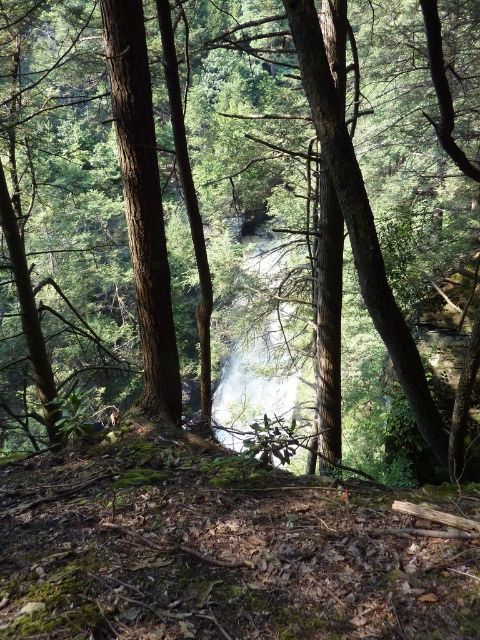
You are standing in the forest and want to take a photo of both the smooth brown tree trunk at center and the white misty waterfall at center. Which object should you focus on first to ensure both are in clear view?

You should focus on the smooth brown tree trunk at center first because it is closer to you than the white misty waterfall at center. By focusing on the closer object, you can ensure both are in focus as the waterfall is further away.

You are a hiker trying to cross the forest. You see the smooth brown tree trunk at center and the white misty waterfall at center. Which object is narrower?

The smooth brown tree trunk at center is narrower than the white misty waterfall at center.

You are standing in the forest scene described, and you want to reach a specific point marked at coordinates point (122, 92). If your walking speed is 3 feet per second, how many seconds will it take you to reach that point?

The distance of point (122, 92) from viewer is 14.03 feet, so it will take approximately 4.68 seconds to reach that point since 14.03 divided by 3 equals approximately 4.68 seconds.